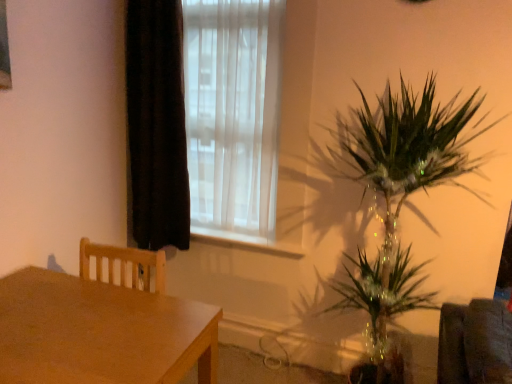
Question: From their relative heights in the image, would you say white sheer curtain at upper center is taller or shorter than white plastic window sill at center?

Choices:
 (A) short
 (B) tall

Answer: (B)

Question: In terms of size, does white sheer curtain at upper center appear bigger or smaller than white plastic window sill at center?

Choices:
 (A) big
 (B) small

Answer: (A)

Question: Estimate the real-world distances between objects in this image. Which object is closer to the black velvet curtain at left?

Choices:
 (A) white sheer curtain at upper center
 (B) white plastic window sill at center
 (C) wooden table at left

Answer: (A)

Question: Which object is positioned closest to the black velvet curtain at left?

Choices:
 (A) wooden table at left
 (B) white sheer curtain at upper center
 (C) white plastic window sill at center

Answer: (B)